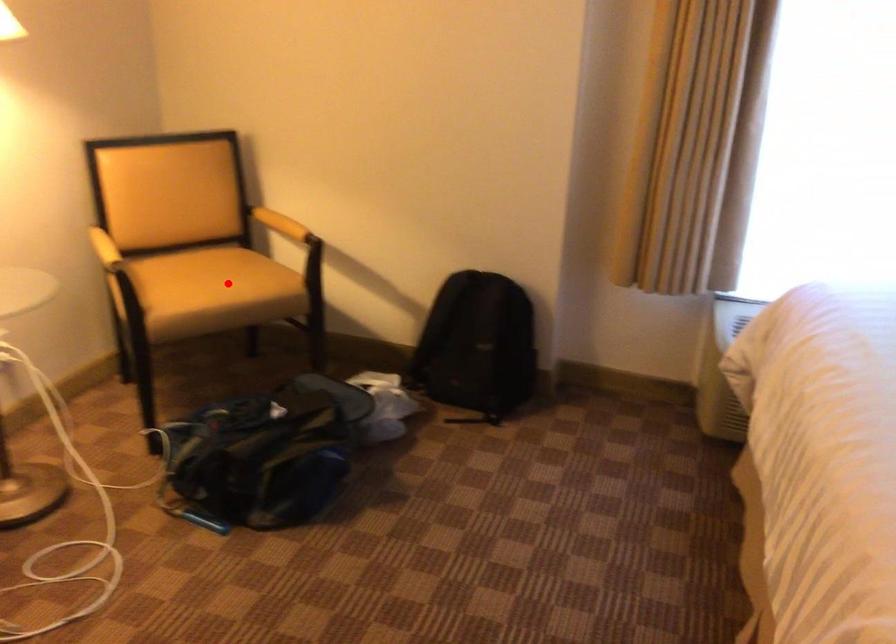
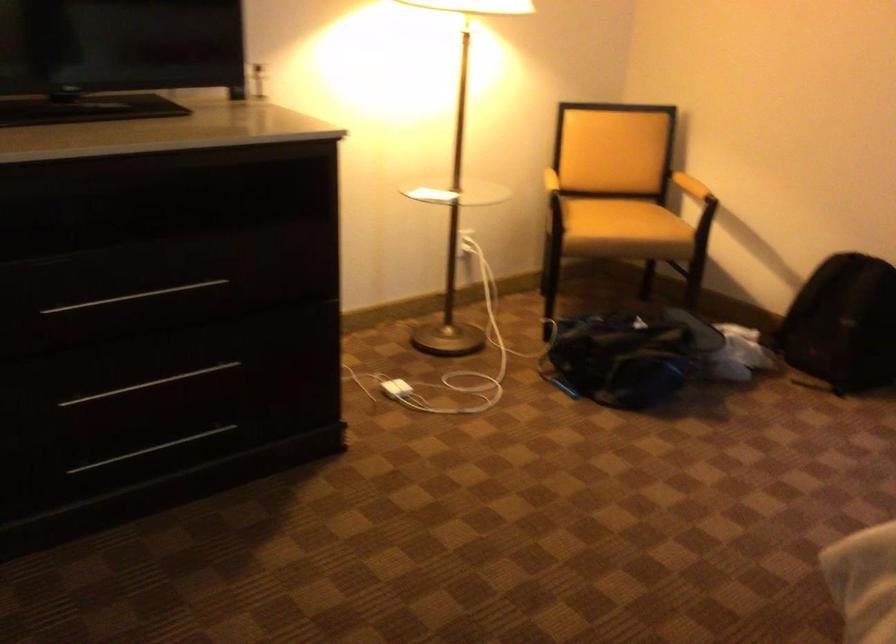
Question: I am providing you with two images of the same scene from different viewpoints. A red point is shown in image1. For the corresponding object point in image2, is it positioned nearer or farther from the camera?

Choices:
 (A) Nearer
 (B) Farther

Answer: (B)